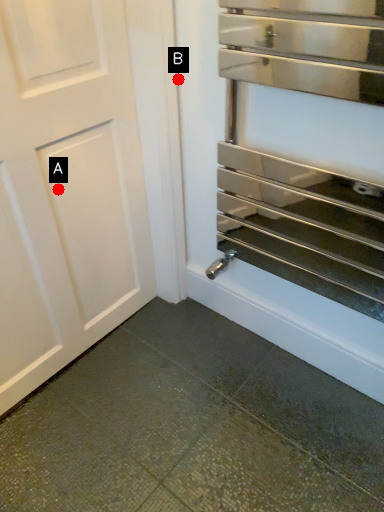
Question: Two points are circled on the image, labeled by A and B beside each circle. Which point is closer to the camera?

Choices:
 (A) A is closer
 (B) B is closer

Answer: (A)